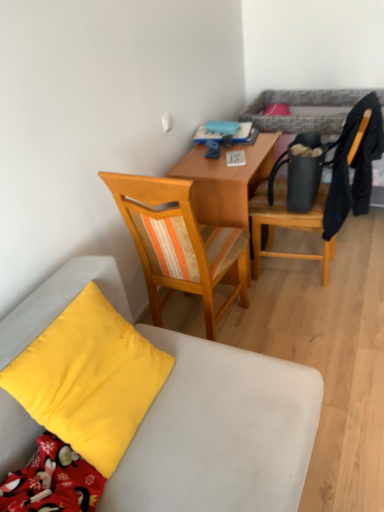
The height and width of the screenshot is (512, 384). In order to click on vacant location below matte black chair at upper right, the first chair in the right-to-left sequence (from a real-world perspective) in this screenshot , I will do `click(306, 272)`.